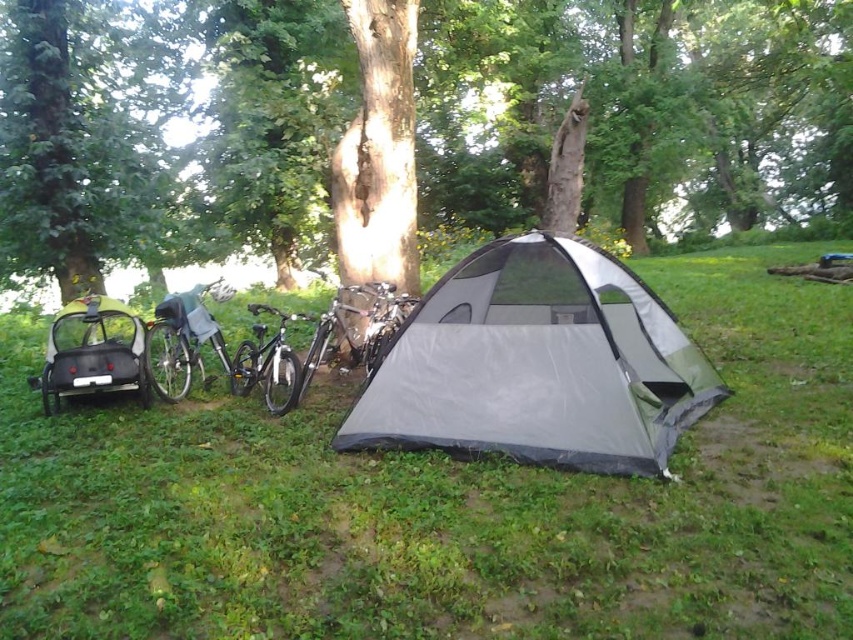
You are planning to set up a picnic in the area where the green grass at center and gray fabric tent at center are located. Which of these two areas has more space available for placing picnic items?

The gray fabric tent at center occupies more space than the green grass at center, so the green grass at center has less space available for placing picnic items.

You are planning to set up a picnic area in the camping scene. Which object, the green grass at center or the green textured tree at center, would allow you to place more items due to its size?

The green textured tree at center occupies more space than the green grass at center, so you can place more items there.